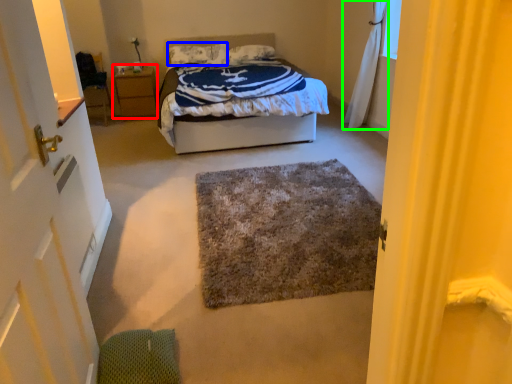
Question: Considering the real-world distances, which object is farthest from nightstand (highlighted by a red box)? pillow (highlighted by a blue box) or curtain (highlighted by a green box)?

Choices:
 (A) pillow
 (B) curtain

Answer: (B)